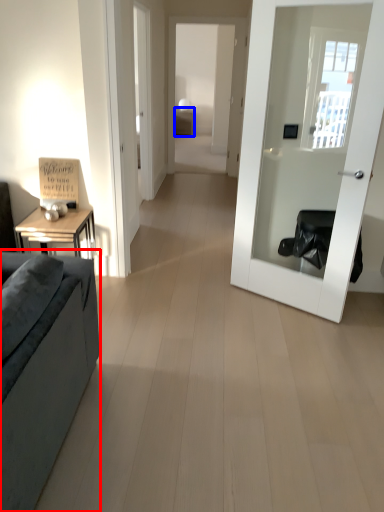
Question: Among these objects, which one is farthest to the camera, studio couch (highlighted by a red box) or table (highlighted by a blue box)?

Choices:
 (A) studio couch
 (B) table

Answer: (B)